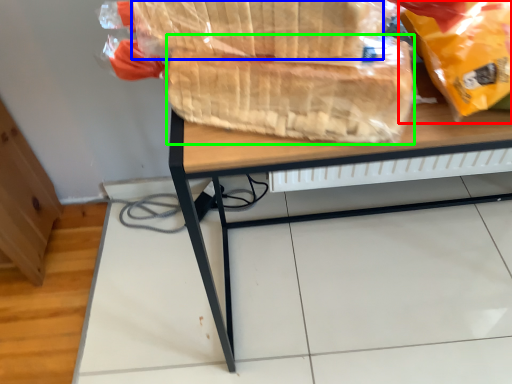
Question: Estimate the real-world distances between objects in this image. Which object is closer to plastic bag (highlighted by a red box), bread (highlighted by a blue box) or bread (highlighted by a green box)?

Choices:
 (A) bread
 (B) bread

Answer: (B)